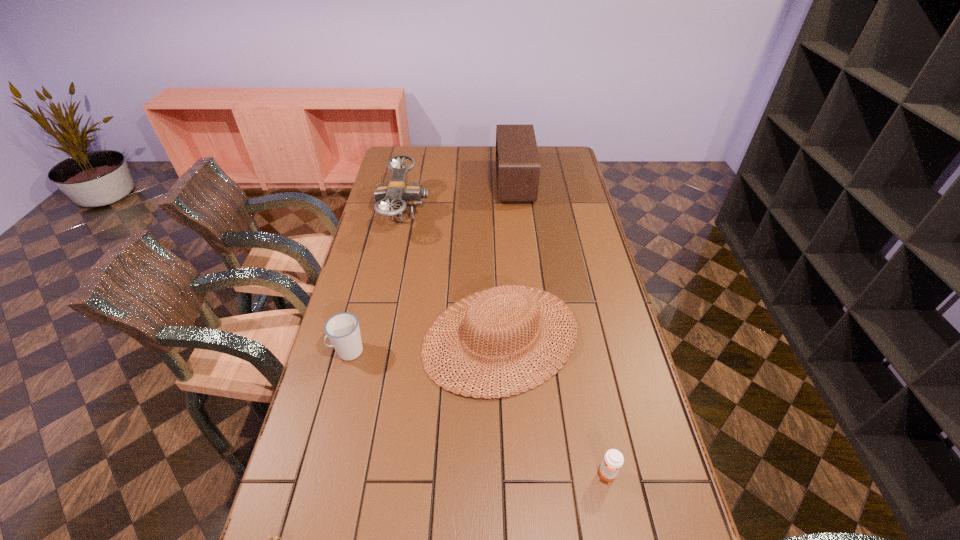
I want to click on unoccupied area between the tallest object and the cup, so click(431, 267).

Where is `vacant space that's between the drone and the sunhat`? The height and width of the screenshot is (540, 960). vacant space that's between the drone and the sunhat is located at coordinates (453, 275).

Where is `empty location between the fifth shortest object and the radio receiver`? empty location between the fifth shortest object and the radio receiver is located at coordinates (460, 198).

You are a GUI agent. You are given a task and a screenshot of the screen. Output one action in this format:
    pyautogui.click(x=<x>, y=<y>)
    Task: Click on the object that stands as the third closest to the cup
    The image size is (960, 540).
    Given the screenshot: What is the action you would take?
    pyautogui.click(x=270, y=537)

Identify which object is located as the third nearest to the radio receiver. Please provide its 2D coordinates. Your answer should be formatted as a tuple, i.e. [(x, y)], where the tuple contains the x and y coordinates of a point satisfying the conditions above.

[(342, 329)]

You are a GUI agent. You are given a task and a screenshot of the screen. Output one action in this format:
    pyautogui.click(x=<x>, y=<y>)
    Task: Click on the free region that satisfies the following two spatial constraints: 1. with a handle on the side of the medicine; 2. on the left side of the cup
    
    Given the screenshot: What is the action you would take?
    pyautogui.click(x=315, y=475)

Find the location of a particular element. free spot that satisfies the following two spatial constraints: 1. on the front-facing side of the drone; 2. on the right side of the sunhat is located at coordinates (379, 337).

I want to click on vacant position in the image that satisfies the following two spatial constraints: 1. with a handle on the side of the cup; 2. on the back side of the second shortest object, so (315, 475).

The width and height of the screenshot is (960, 540). Identify the location of free space that satisfies the following two spatial constraints: 1. on the front-facing side of the tallest object; 2. on the front side of the sunhat. (531, 337).

The image size is (960, 540). I want to click on vacant space that satisfies the following two spatial constraints: 1. on the back side of the fifth farthest object; 2. with a handle on the side of the cup, so click(x=583, y=351).